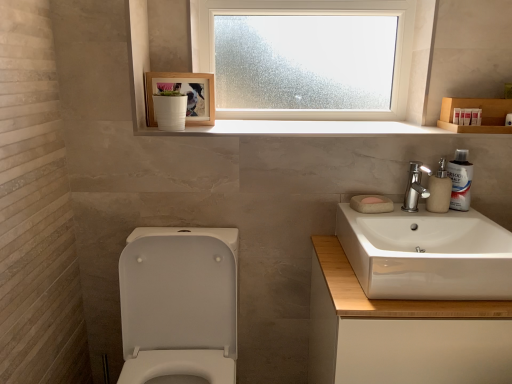
Question: From a real-world perspective, is white matte soap at sink over white wood shelf at upper center?

Choices:
 (A) yes
 (B) no

Answer: (B)

Question: Is white matte soap at sink wider than white wood shelf at upper center?

Choices:
 (A) no
 (B) yes

Answer: (A)

Question: Considering the relative sizes of white matte soap at sink and white wood shelf at upper center in the image provided, is white matte soap at sink taller than white wood shelf at upper center?

Choices:
 (A) yes
 (B) no

Answer: (A)

Question: Does white matte soap at sink come in front of white wood shelf at upper center?

Choices:
 (A) no
 (B) yes

Answer: (B)

Question: Is white matte soap at sink touching white wood shelf at upper center?

Choices:
 (A) yes
 (B) no

Answer: (B)

Question: From a real-world perspective, is white wood shelf at upper center physically located above or below white matte soap at sink?

Choices:
 (A) below
 (B) above

Answer: (B)

Question: Is white wood shelf at upper center inside or outside of white matte soap at sink?

Choices:
 (A) inside
 (B) outside

Answer: (B)

Question: Considering their positions, is white wood shelf at upper center located in front of or behind white matte soap at sink?

Choices:
 (A) behind
 (B) front

Answer: (A)

Question: In terms of size, does white wood shelf at upper center appear bigger or smaller than white matte soap at sink?

Choices:
 (A) big
 (B) small

Answer: (A)

Question: Is white glossy toilet at lower left to the left or to the right of white plastic toothpaste tube at upper right, arranged as the first toiletry when viewed from the right, in the image?

Choices:
 (A) left
 (B) right

Answer: (A)

Question: Relative to white plastic toothpaste tube at upper right, arranged as the first toiletry when viewed from the right, is white glossy toilet at lower left in front or behind?

Choices:
 (A) front
 (B) behind

Answer: (A)

Question: Is white glossy toilet at lower left situated inside white plastic toothpaste tube at upper right, marked as the third toiletry in a left-to-right arrangement, or outside?

Choices:
 (A) inside
 (B) outside

Answer: (B)

Question: From the image's perspective, is white glossy toilet at lower left positioned above or below white plastic toothpaste tube at upper right, arranged as the first toiletry when viewed from the right?

Choices:
 (A) below
 (B) above

Answer: (A)

Question: Relative to frosted glass window at upper center, is white glossy toilet at lower left in front or behind?

Choices:
 (A) behind
 (B) front

Answer: (B)

Question: Would you say white glossy toilet at lower left is inside or outside frosted glass window at upper center?

Choices:
 (A) inside
 (B) outside

Answer: (B)